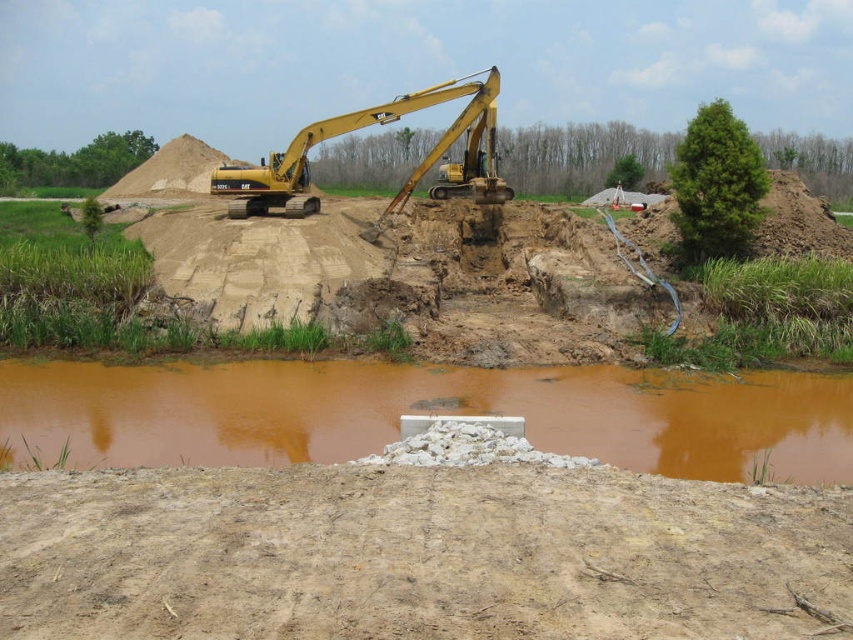
Is brown sediment water at center to the left of yellow metallic excavator at center from the viewer's perspective?

No, brown sediment water at center is not to the left of yellow metallic excavator at center.

Does point (773, 384) lie behind point (457, 132)?

No, it is in front of (457, 132).

The width and height of the screenshot is (853, 640). In order to click on brown sediment water at center in this screenshot , I will do `click(424, 412)`.

Locate an element on the screen. The height and width of the screenshot is (640, 853). dull brown dirt at lower center is located at coordinates (418, 556).

Is point (518, 536) in front of point (303, 205)?

Yes, point (518, 536) is in front of point (303, 205).

Does point (553, 614) come farther from viewer compared to point (308, 209)?

No, it is in front of (308, 209).

Where is `dull brown dirt at lower center`? This screenshot has width=853, height=640. dull brown dirt at lower center is located at coordinates click(x=418, y=556).

Can you confirm if dull brown dirt at lower center is wider than brown sediment water at center?

In fact, dull brown dirt at lower center might be narrower than brown sediment water at center.

Is point (490, 577) positioned behind point (827, 436)?

That is False.

Locate an element on the screen. The image size is (853, 640). dull brown dirt at lower center is located at coordinates (418, 556).